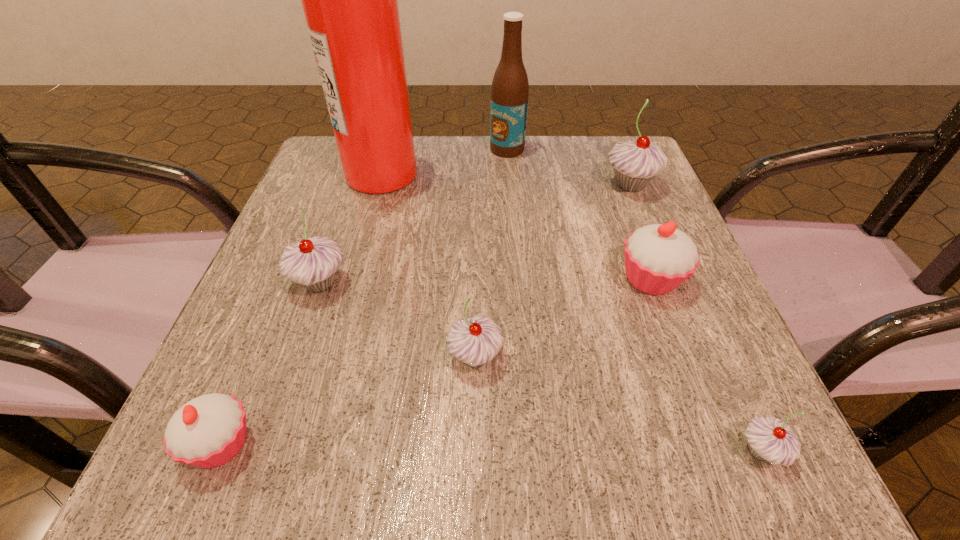
Where is `vacant space situated 0.330m on the back of the left pink cupcake`? The width and height of the screenshot is (960, 540). vacant space situated 0.330m on the back of the left pink cupcake is located at coordinates (304, 244).

You are a GUI agent. You are given a task and a screenshot of the screen. Output one action in this format:
    pyautogui.click(x=<x>, y=<y>)
    Task: Click on the fire extinguisher located at the far edge
    This screenshot has height=540, width=960.
    Given the screenshot: What is the action you would take?
    pyautogui.click(x=350, y=0)

The image size is (960, 540). In order to click on beer bottle positioned at the far edge in this screenshot , I will do tap(510, 89).

You are a GUI agent. You are given a task and a screenshot of the screen. Output one action in this format:
    pyautogui.click(x=<x>, y=<y>)
    Task: Click on the cupcake located in the far edge section of the desktop
    Image resolution: width=960 pixels, height=540 pixels.
    Given the screenshot: What is the action you would take?
    pyautogui.click(x=636, y=163)

I want to click on fire extinguisher that is at the left edge, so click(350, 0).

Locate an element on the screen. object positioned at the far left corner is located at coordinates (350, 0).

Where is `object present at the near left corner`? object present at the near left corner is located at coordinates (208, 431).

Locate an element on the screen. The image size is (960, 540). object that is at the far right corner is located at coordinates 636,163.

The image size is (960, 540). What are the coordinates of `object that is positioned at the near right corner` in the screenshot? It's located at (770, 439).

Locate an element on the screen. The height and width of the screenshot is (540, 960). vacant space at the far edge is located at coordinates tap(479, 179).